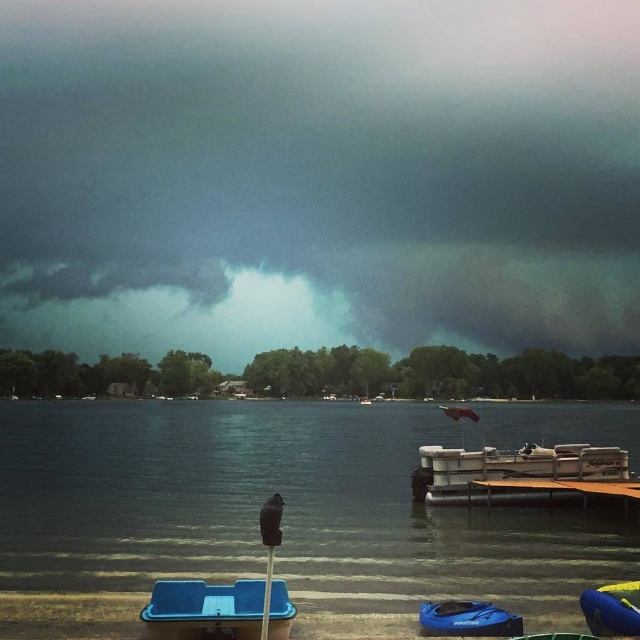
Question: Estimate the real-world distances between objects in this image. Which object is farther from the blue matte boat at lower center?

Choices:
 (A) dark gray cloud at upper center
 (B) blue plastic boat at lower center
 (C) clear water at lower center

Answer: (A)

Question: Does blue plastic boat at lower center appear on the left side of yellow-green rubber boat at lower right?

Choices:
 (A) yes
 (B) no

Answer: (A)

Question: Is clear water at lower center positioned at the back of blue plastic boat at lower center?

Choices:
 (A) yes
 (B) no

Answer: (B)

Question: Which object is the farthest from the dark gray cloud at upper center?

Choices:
 (A) blue matte boat at lower center
 (B) blue plastic boat at lower center
 (C) yellow-green rubber boat at lower right

Answer: (C)

Question: Which is farther from the dark gray cloud at upper center?

Choices:
 (A) blue plastic boat at lower center
 (B) blue matte boat at lower center

Answer: (B)

Question: From the image, what is the correct spatial relationship of clear water at lower center in relation to yellow-green rubber boat at lower right?

Choices:
 (A) above
 (B) below

Answer: (B)